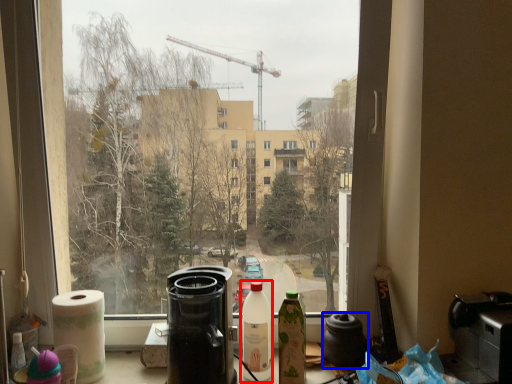
Question: Which point is closer to the camera, bottle (highlighted by a red box) or coffeepot (highlighted by a blue box)?

Choices:
 (A) bottle
 (B) coffeepot

Answer: (A)